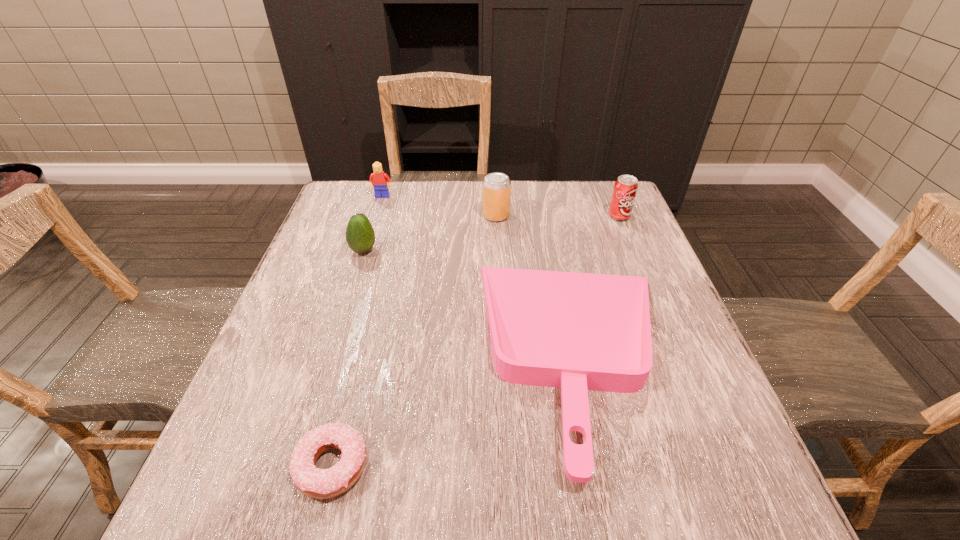
Where is `empty space that is in between the left soda and the doughnut`? Image resolution: width=960 pixels, height=540 pixels. empty space that is in between the left soda and the doughnut is located at coordinates (415, 341).

You are a GUI agent. You are given a task and a screenshot of the screen. Output one action in this format:
    pyautogui.click(x=<x>, y=<y>)
    Task: Click on the object that can be found as the fifth closest to the Lego
    This screenshot has width=960, height=540.
    Given the screenshot: What is the action you would take?
    pyautogui.click(x=316, y=483)

At what (x,y) coordinates should I click in order to perform the action: click on object that stands as the fifth closest to the right soda. Please return your answer as a coordinate pair (x, y). The width and height of the screenshot is (960, 540). Looking at the image, I should click on (316, 483).

The height and width of the screenshot is (540, 960). I want to click on free space in the image that satisfies the following two spatial constraints: 1. on the back side of the doughnut; 2. on the left side of the right soda, so click(396, 217).